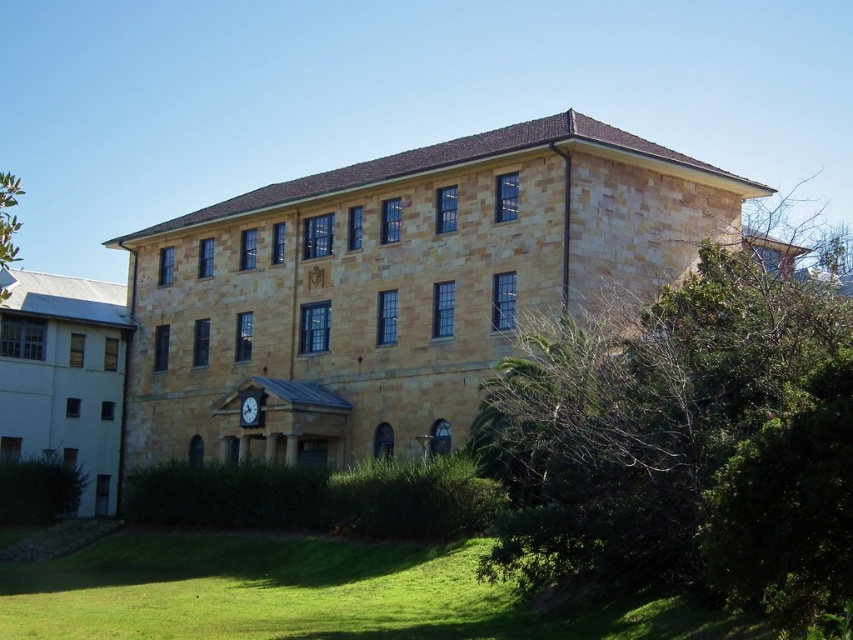
Between point (328, 612) and point (242, 417), which one is positioned behind?

The point (242, 417) is more distant.

How much distance is there between green grass at lower left and wooden clock at center?

green grass at lower left is 18.25 meters from wooden clock at center.

Which is behind, point (357, 580) or point (247, 422)?

The point (247, 422) is more distant.

Find the location of `green grass at lower left`. green grass at lower left is located at coordinates (312, 595).

Does green leafy bush at lower right have a greater width compared to green grass at lower left?

Incorrect, green leafy bush at lower right's width does not surpass green grass at lower left's.

Who is positioned more to the right, green leafy bush at lower right or green grass at lower left?

green leafy bush at lower right is more to the right.

Is point (776, 387) less distant than point (361, 634)?

Yes, it is in front of point (361, 634).

Where is `green leafy bush at lower right`? Image resolution: width=853 pixels, height=640 pixels. green leafy bush at lower right is located at coordinates (683, 444).

Is point (106, 554) less distant than point (4, 268)?

Yes, point (106, 554) is in front of point (4, 268).

Is green grass at lower left taller than green leafy tree at upper left?

Incorrect, green grass at lower left's height is not larger of green leafy tree at upper left's.

Locate an element on the screen. green grass at lower left is located at coordinates (312, 595).